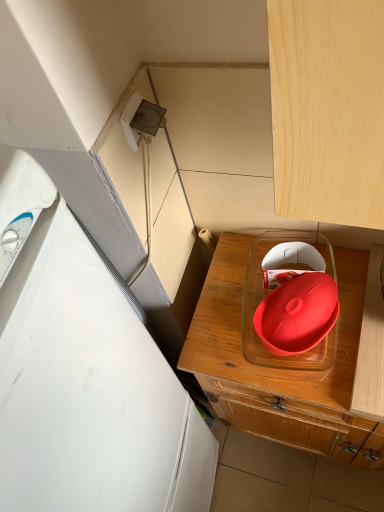
Locate an element on the screen. The image size is (384, 512). matte plastic tray at center is located at coordinates (294, 370).

Image resolution: width=384 pixels, height=512 pixels. Describe the element at coordinates (294, 370) in the screenshot. I see `matte plastic tray at center` at that location.

What are the coordinates of `rubberized red lid at center` in the screenshot? It's located at (290, 302).

Does point (49, 398) come in front of point (330, 436)?

Yes, it is.

Is white plastic refrigerator at left placed right next to matte plastic tray at center?

white plastic refrigerator at left and matte plastic tray at center are clearly separated.

Can matte plastic tray at center be found inside white plastic refrigerator at left?

No.

How different are the orientations of white plastic refrigerator at left and matte plastic tray at center in degrees?

There is a 90-degree angle between the facing directions of white plastic refrigerator at left and matte plastic tray at center.

Does rubberized red lid at center come in front of white plastic refrigerator at left?

No, it is not.

Considering the relative sizes of rubberized red lid at center and white plastic refrigerator at left in the image provided, is rubberized red lid at center bigger than white plastic refrigerator at left?

Actually, rubberized red lid at center might be smaller than white plastic refrigerator at left.

Based on the photo, from a real-world perspective, is rubberized red lid at center positioned above or below white plastic refrigerator at left?

rubberized red lid at center is above white plastic refrigerator at left.

Is rubberized red lid at center positioned with its back to matte plastic tray at center?

rubberized red lid at center is not turned away from matte plastic tray at center.

Is rubberized red lid at center in front of matte plastic tray at center?

No, it is behind matte plastic tray at center.

Is rubberized red lid at center wider or thinner than matte plastic tray at center?

rubberized red lid at center is thinner than matte plastic tray at center.

Which is nearer, (289, 268) or (279, 378)?

The point (279, 378) is more forward.

From the image's perspective, does matte plastic tray at center appear higher than rubberized red lid at center?

Incorrect, from the image's perspective, matte plastic tray at center is lower than rubberized red lid at center.

Is matte plastic tray at center aimed at rubberized red lid at center?

No, matte plastic tray at center is not oriented towards rubberized red lid at center.

In terms of size, does matte plastic tray at center appear bigger or smaller than rubberized red lid at center?

Clearly, matte plastic tray at center is larger in size than rubberized red lid at center.

Looking at this image, how many degrees apart are the facing directions of matte plastic tray at center and rubberized red lid at center?

They differ by 8.17 degrees in their facing directions.

Based on their positions, is matte plastic tray at center located to the left or right of white plastic refrigerator at left?

Clearly, matte plastic tray at center is on the right of white plastic refrigerator at left in the image.

Is matte plastic tray at center situated inside white plastic refrigerator at left or outside?

matte plastic tray at center lies outside white plastic refrigerator at left.

Is point (365, 304) in front of point (128, 303)?

No, it is not.

From the image's perspective, is matte plastic tray at center below white plastic refrigerator at left?

Incorrect, from the image's perspective, matte plastic tray at center is higher than white plastic refrigerator at left.

Which of these two, white plastic refrigerator at left or rubberized red lid at center, is wider?

white plastic refrigerator at left.

Considering the relative sizes of white plastic refrigerator at left and rubberized red lid at center in the image provided, is white plastic refrigerator at left taller than rubberized red lid at center?

Indeed, white plastic refrigerator at left has a greater height compared to rubberized red lid at center.

From the picture: Which object is positioned more to the right, white plastic refrigerator at left or rubberized red lid at center?

rubberized red lid at center.

Where is `home appliance that is above the matte plastic tray at center (from a real-world perspective)`? This screenshot has width=384, height=512. home appliance that is above the matte plastic tray at center (from a real-world perspective) is located at coordinates (86, 379).

This screenshot has height=512, width=384. In order to click on appliance on the right of white plastic refrigerator at left in this screenshot , I will do `click(290, 302)`.

When comparing their distances from matte plastic tray at center, does rubberized red lid at center or white plastic refrigerator at left seem further?

white plastic refrigerator at left lies further to matte plastic tray at center than the other object.

From the image, which object appears to be farther from rubberized red lid at center, white plastic refrigerator at left or matte plastic tray at center?

The object further to rubberized red lid at center is white plastic refrigerator at left.

Considering their positions, is white plastic refrigerator at left positioned further to matte plastic tray at center than rubberized red lid at center?

The object further to matte plastic tray at center is white plastic refrigerator at left.

Based on their spatial positions, is matte plastic tray at center or rubberized red lid at center further from white plastic refrigerator at left?

rubberized red lid at center is further to white plastic refrigerator at left.

From the image, which object appears to be nearer to white plastic refrigerator at left, rubberized red lid at center or matte plastic tray at center?

matte plastic tray at center is positioned closer to the anchor white plastic refrigerator at left.

Considering their positions, is matte plastic tray at center positioned closer to rubberized red lid at center than white plastic refrigerator at left?

matte plastic tray at center lies closer to rubberized red lid at center than the other object.

I want to click on cabinetry positioned between white plastic refrigerator at left and rubberized red lid at center from near to far, so click(294, 370).